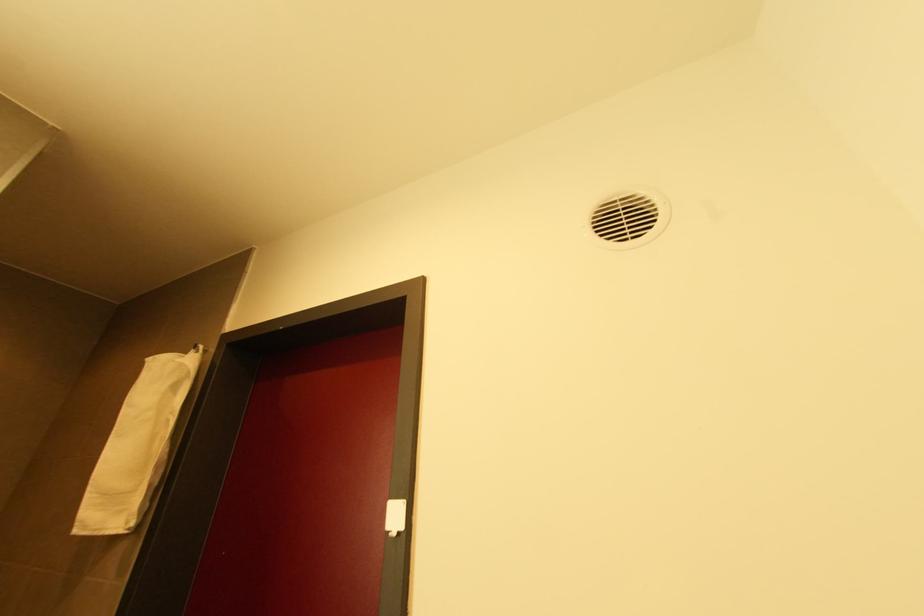
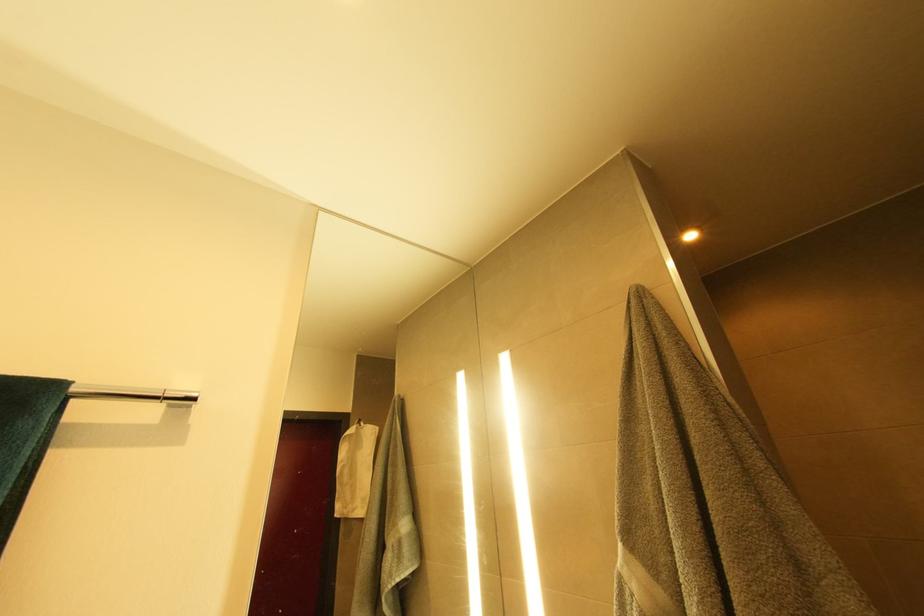
First-person continuous shooting, in which direction is the camera rotating?

The rotation direction of the camera is left-up.